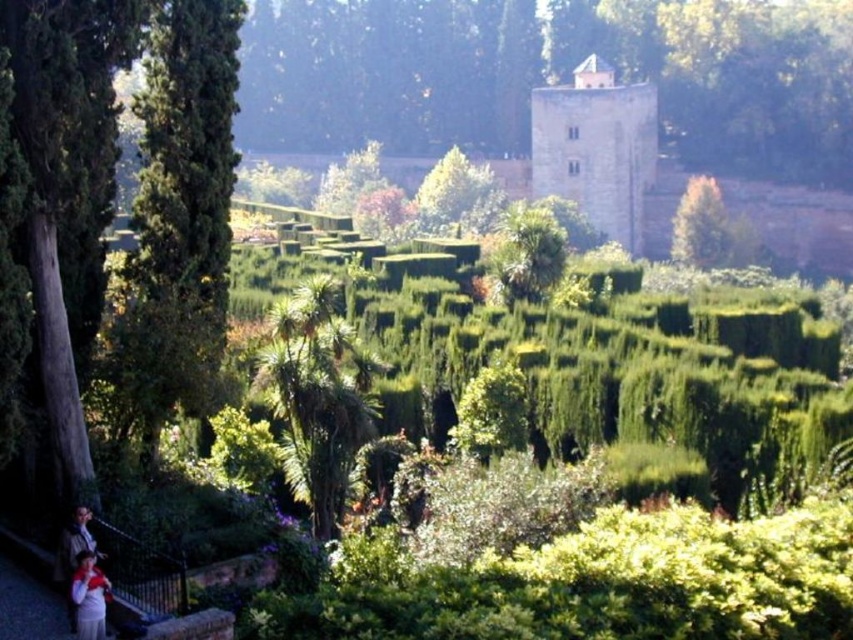
Consider the image. You are a gardener in the garden and you want to place a new decorative pot between the matte white shirt at lower left and the light brown fabric at lower left. Which object should you position the pot closer to if you want the pot to be closer to the narrower object?

The matte white shirt at lower left has a smaller width than the light brown fabric at lower left. Therefore, to place the pot closer to the narrower object, position it near the matte white shirt at lower left.

You are planning to plant a new flower bed between the green textured tree at left and the green leafy palm at center. Which tree should you consider for spacing requirements based on their widths?

The green textured tree at left might be wider than the green leafy palm at center, so you should consider the width of the green textured tree at left when planning the flower bed spacing.